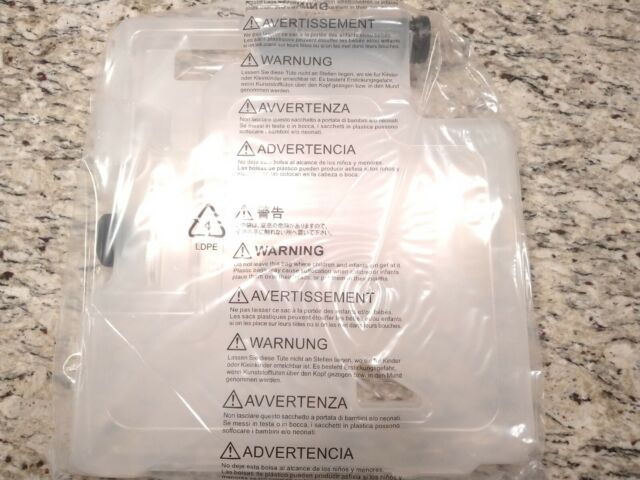
The image size is (640, 480). What are the coordinates of `rubber stopper` in the screenshot? It's located at (417, 32).